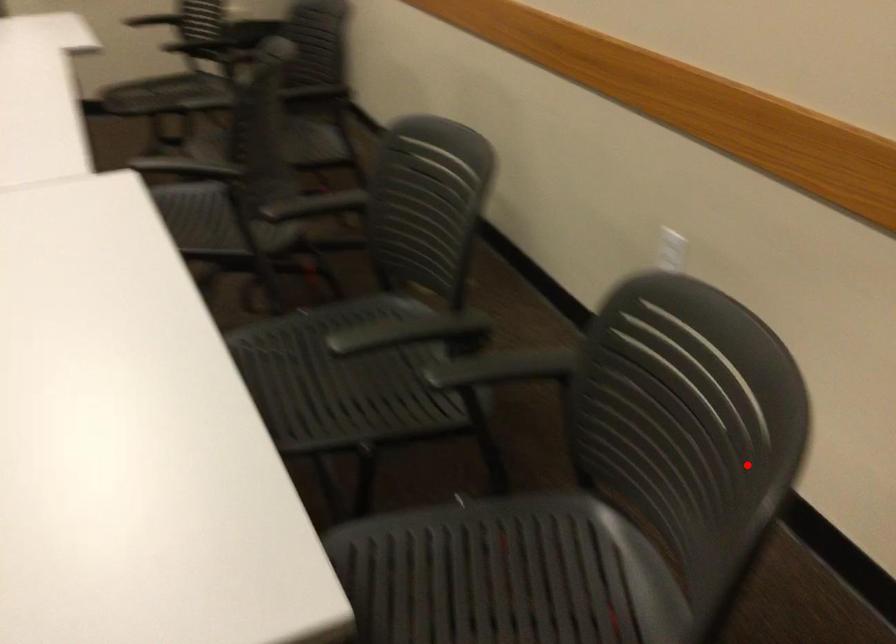
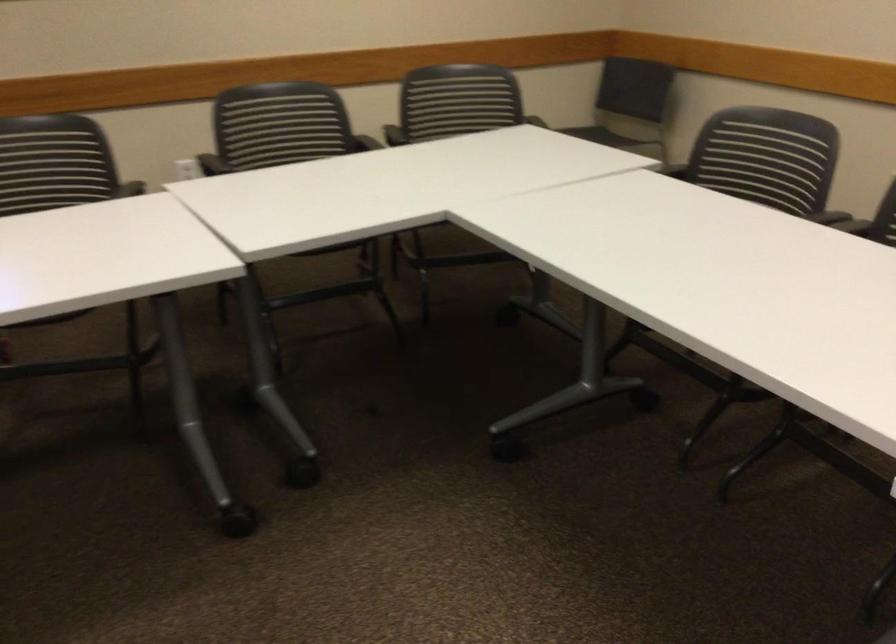
Locate, in the second image, the point that corresponds to the highlighted location in the first image.

(455, 100)